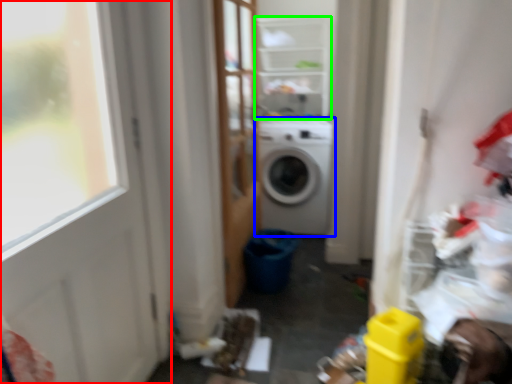
Question: Which is farther away from door (highlighted by a red box)? washing machine (highlighted by a blue box) or shelf (highlighted by a green box)?

Choices:
 (A) washing machine
 (B) shelf

Answer: (B)